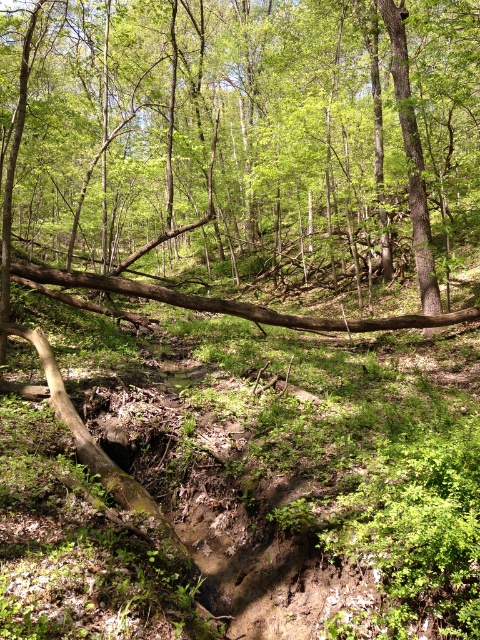
Is brown rough log at center to the right of brown rough tree trunk at upper center from the viewer's perspective?

In fact, brown rough log at center is to the left of brown rough tree trunk at upper center.

Looking at this image, between brown rough log at center and brown rough tree trunk at upper center, which one has less height?

Standing shorter between the two is brown rough tree trunk at upper center.

Does point (37, 93) lie in front of point (387, 6)?

No, (37, 93) is behind (387, 6).

This screenshot has width=480, height=640. Identify the location of brown rough log at center. (247, 152).